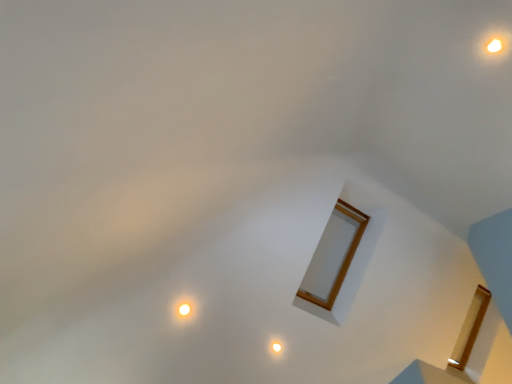
Question: From the image's perspective, does matte white light at center appear higher than matte white light at lower left?

Choices:
 (A) yes
 (B) no

Answer: (B)

Question: Is matte white light at center outside matte white light at lower left?

Choices:
 (A) yes
 (B) no

Answer: (A)

Question: Is matte white light at center shorter than matte white light at lower left?

Choices:
 (A) no
 (B) yes

Answer: (B)

Question: Is matte white light at center wider than matte white light at lower left?

Choices:
 (A) yes
 (B) no

Answer: (B)

Question: Would you consider matte white light at center to be distant from matte white light at lower left?

Choices:
 (A) no
 (B) yes

Answer: (A)

Question: Does matte white light at center have a lesser width compared to matte white light at lower left?

Choices:
 (A) yes
 (B) no

Answer: (A)

Question: Considering the relative sizes of matte white light at lower left and matte white light at center in the image provided, is matte white light at lower left taller than matte white light at center?

Choices:
 (A) no
 (B) yes

Answer: (B)

Question: Are matte white light at lower left and matte white light at center far apart?

Choices:
 (A) no
 (B) yes

Answer: (A)

Question: From a real-world perspective, is matte white light at lower left under matte white light at center?

Choices:
 (A) yes
 (B) no

Answer: (B)

Question: Could you tell me if matte white light at lower left is turned towards matte white light at center?

Choices:
 (A) no
 (B) yes

Answer: (A)

Question: Does matte white light at lower left lie in front of matte white light at center?

Choices:
 (A) no
 (B) yes

Answer: (B)

Question: Is matte white light at lower left bigger than matte white light at center?

Choices:
 (A) yes
 (B) no

Answer: (A)

Question: Is matte white light at lower left in front of or behind matte white light at center in the image?

Choices:
 (A) behind
 (B) front

Answer: (B)